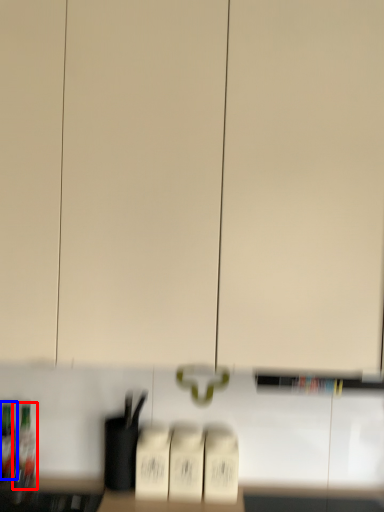
Question: Which object is closer to the camera taking this photo, bottle (highlighted by a red box) or bottle (highlighted by a blue box)?

Choices:
 (A) bottle
 (B) bottle

Answer: (A)